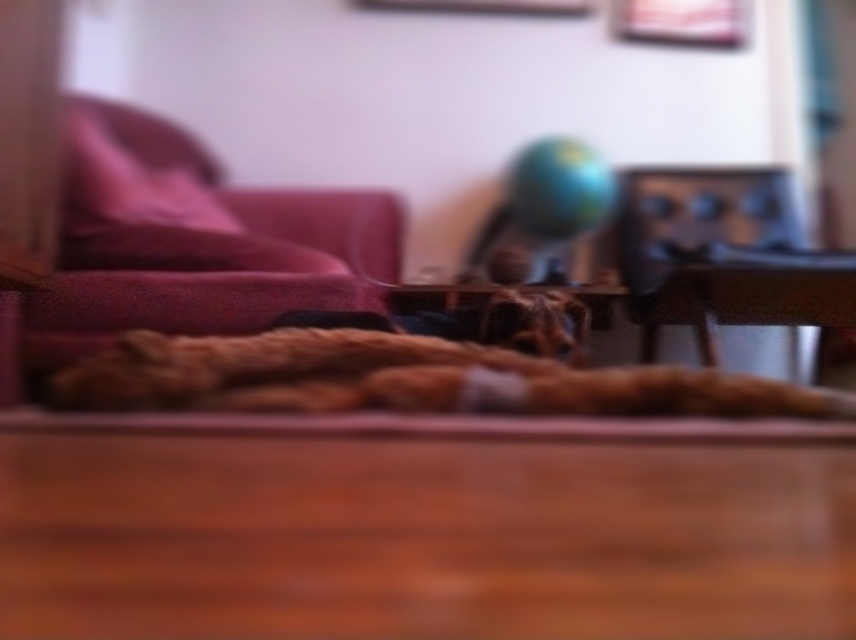
Question: Does shiny metallic globe at center come behind wooden picture frame at upper center?

Choices:
 (A) no
 (B) yes

Answer: (A)

Question: Among these points, which one is farthest from the camera?

Choices:
 (A) (409, 3)
 (B) (560, 196)
 (C) (734, 20)
 (D) (421, 353)

Answer: (C)

Question: In this image, where is fluffy brown dog at center located relative to shiny metallic globe at center?

Choices:
 (A) left
 (B) right

Answer: (A)

Question: Observing the image, what is the correct spatial positioning of shiny metallic globe at center in reference to metallic silver picture frame at upper center?

Choices:
 (A) above
 (B) below

Answer: (B)

Question: Which point is closer to the camera?

Choices:
 (A) (373, 0)
 (B) (669, 372)

Answer: (B)

Question: Which object appears farthest from the camera in this image?

Choices:
 (A) wooden picture frame at upper center
 (B) metallic silver picture frame at upper center
 (C) shiny metallic globe at center

Answer: (B)